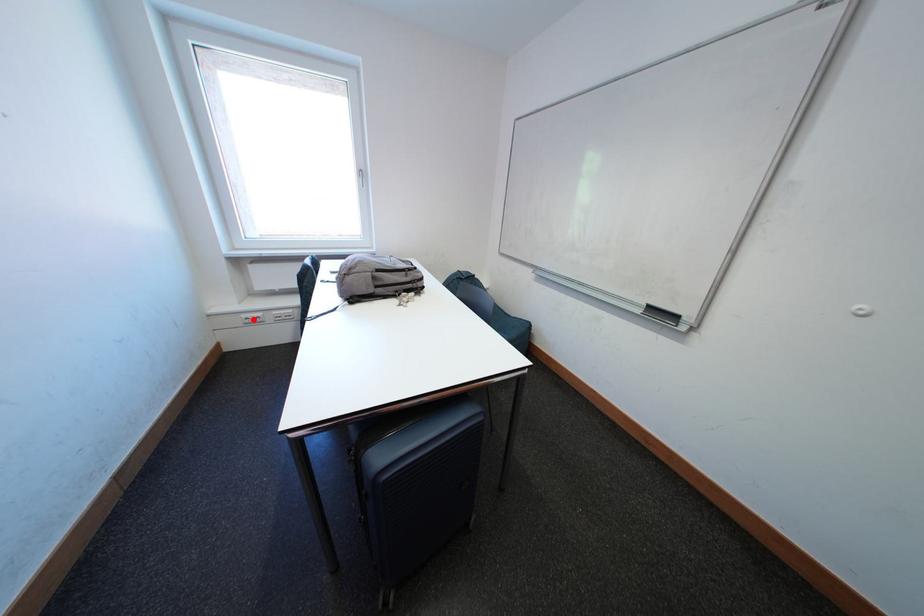
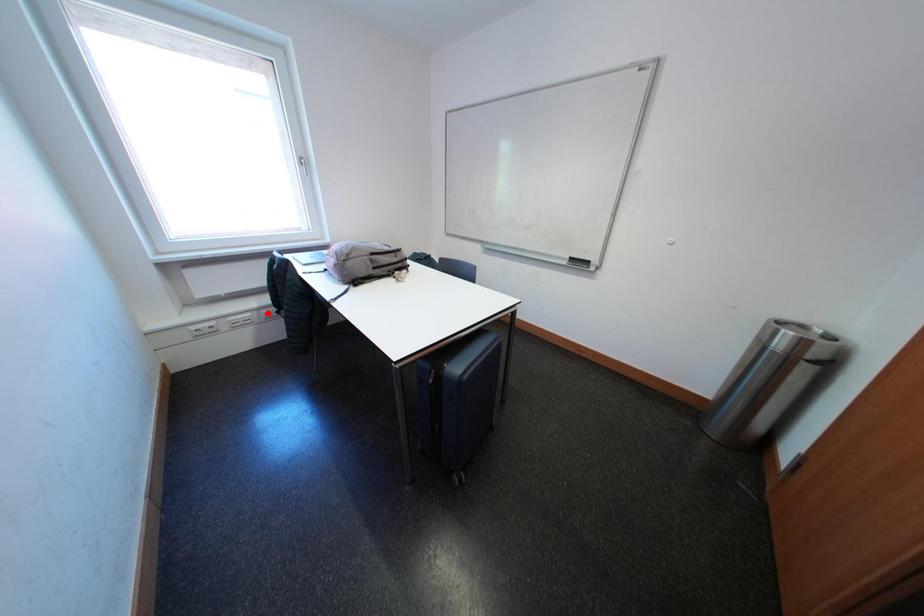
I am providing you with two images of the same scene from different viewpoints. A red point is marked on the first image and another point is marked on the second image. Is the marked point in image1 the same physical position as the marked point in image2?

No